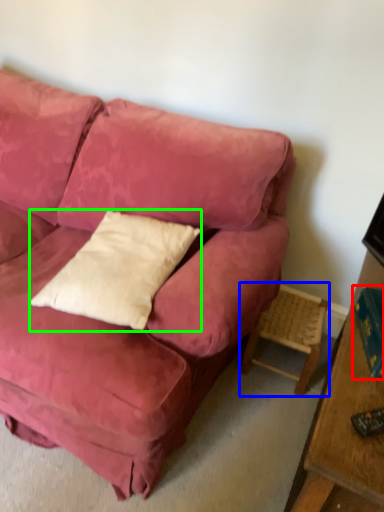
Question: Which object is the closest to the book (highlighted by a red box)? Choose among these: side table (highlighted by a blue box) or pillow (highlighted by a green box).

Choices:
 (A) side table
 (B) pillow

Answer: (A)